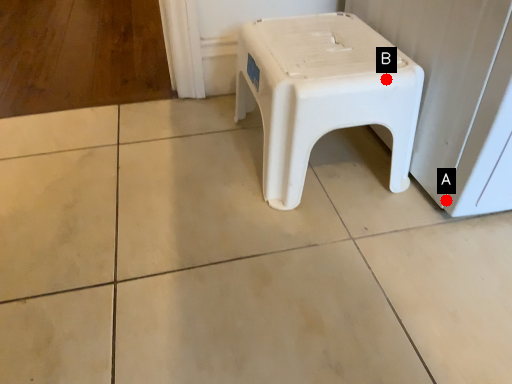
Question: Two points are circled on the image, labeled by A and B beside each circle. Which point appears closest to the camera in this image?

Choices:
 (A) A is closer
 (B) B is closer

Answer: (B)